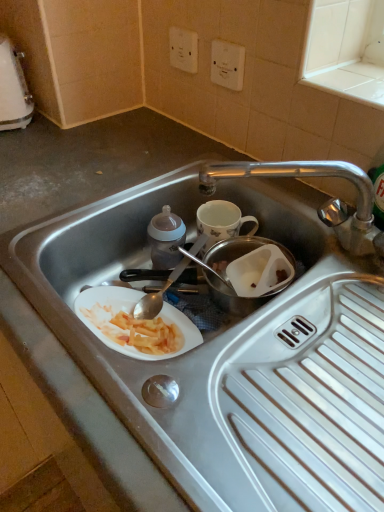
Question: Is white plastic electric outlet at upper center, which is the 1th electric outlet from left to right, thinner than transparent plastic container at center?

Choices:
 (A) yes
 (B) no

Answer: (A)

Question: From a real-world perspective, is white plastic electric outlet at upper center, arranged as the second electric outlet when viewed from the right, physically above transparent plastic container at center?

Choices:
 (A) no
 (B) yes

Answer: (B)

Question: Does white plastic electric outlet at upper center, which is the 1th electric outlet from left to right, have a smaller size compared to transparent plastic container at center?

Choices:
 (A) no
 (B) yes

Answer: (B)

Question: Is white plastic electric outlet at upper center, which is the 1th electric outlet from left to right, not close to transparent plastic container at center?

Choices:
 (A) no
 (B) yes

Answer: (A)

Question: Does white plastic electric outlet at upper center, arranged as the second electric outlet when viewed from the right, contain transparent plastic container at center?

Choices:
 (A) no
 (B) yes

Answer: (A)

Question: In terms of width, does stainless steel sink at center look wider or thinner when compared to white plastic kettle at upper left?

Choices:
 (A) wide
 (B) thin

Answer: (A)

Question: From a real-world perspective, relative to white plastic kettle at upper left, is stainless steel sink at center vertically above or below?

Choices:
 (A) below
 (B) above

Answer: (A)

Question: Is point (228, 444) positioned closer to the camera than point (1, 108)?

Choices:
 (A) closer
 (B) farther

Answer: (A)

Question: Is stainless steel sink at center taller or shorter than white plastic kettle at upper left?

Choices:
 (A) tall
 (B) short

Answer: (B)

Question: Is stainless steel sink at center spatially inside white plastic electric outlet at upper center, which is the 1th electric outlet from left to right, or outside of it?

Choices:
 (A) inside
 (B) outside

Answer: (B)

Question: From the image's perspective, is stainless steel sink at center located above or below white plastic electric outlet at upper center, arranged as the second electric outlet when viewed from the right?

Choices:
 (A) below
 (B) above

Answer: (A)

Question: Is point (281, 347) closer or farther from the camera than point (195, 36)?

Choices:
 (A) closer
 (B) farther

Answer: (A)

Question: From their relative heights in the image, would you say stainless steel sink at center is taller or shorter than white plastic electric outlet at upper center, arranged as the second electric outlet when viewed from the right?

Choices:
 (A) tall
 (B) short

Answer: (A)

Question: Considering the positions of white plastic kettle at upper left and white plastic electric outlet at upper center, positioned as the first electric outlet in right-to-left order, in the image, is white plastic kettle at upper left wider or thinner than white plastic electric outlet at upper center, positioned as the first electric outlet in right-to-left order,?

Choices:
 (A) wide
 (B) thin

Answer: (A)

Question: Relative to white plastic electric outlet at upper center, positioned as the first electric outlet in right-to-left order, is white plastic kettle at upper left in front or behind?

Choices:
 (A) behind
 (B) front

Answer: (A)